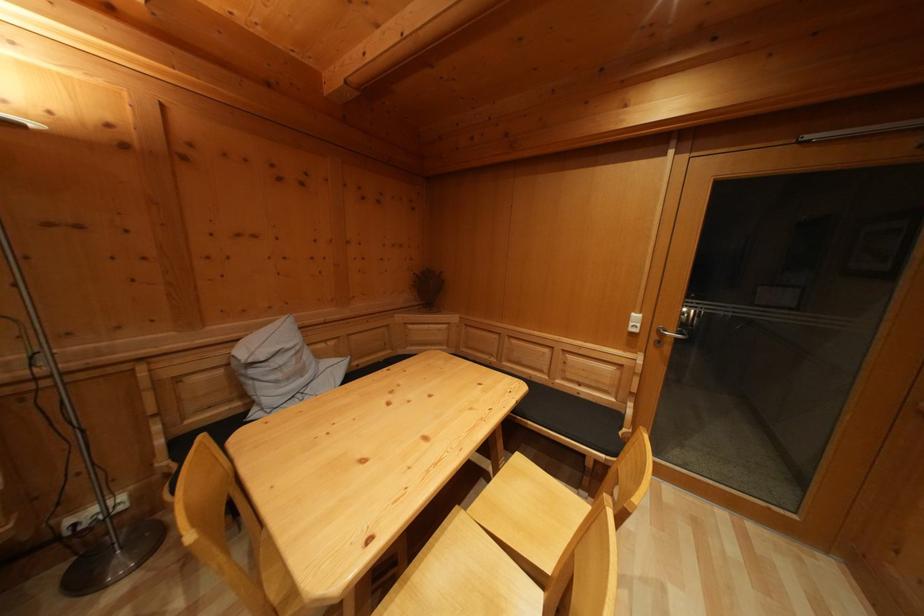
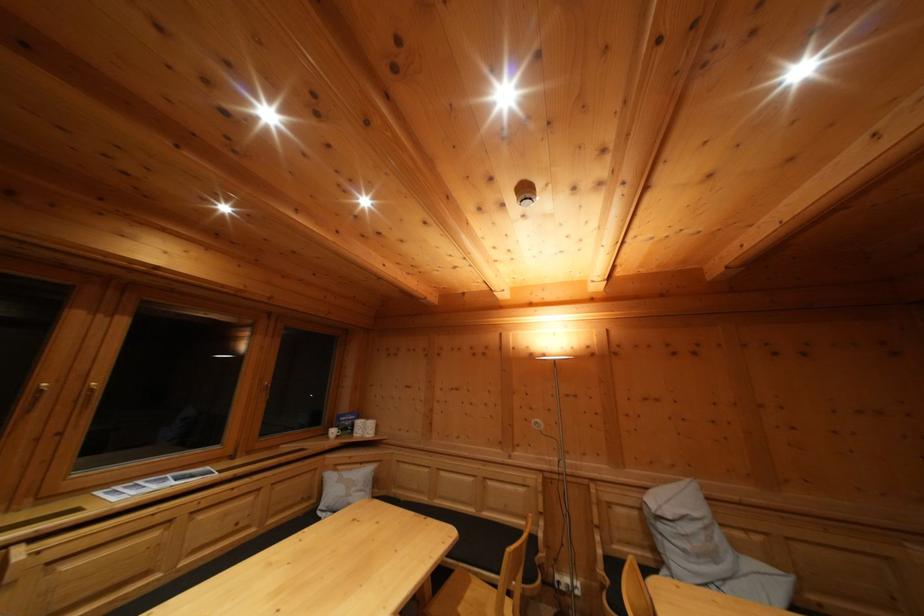
Locate, in the second image, the point that corresponds to pixel 80 532 in the first image.

(565, 590)